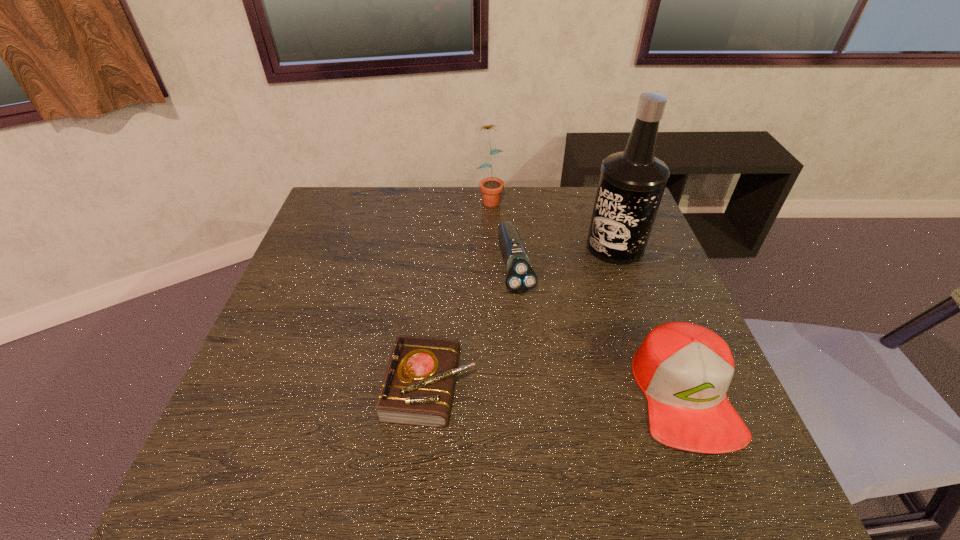
Locate an element on the screen. The width and height of the screenshot is (960, 540). diary is located at coordinates (417, 389).

This screenshot has width=960, height=540. In order to click on baseball cap in this screenshot , I will do `click(684, 370)`.

Find the location of a particular element. The width and height of the screenshot is (960, 540). liquor is located at coordinates (631, 185).

The image size is (960, 540). I want to click on the fourth shortest object, so click(x=491, y=187).

Find the location of `the farthest object`. the farthest object is located at coordinates (491, 187).

At what (x,y) coordinates should I click in order to perform the action: click on electric shaver. Please return your answer as a coordinate pair (x, y). Looking at the image, I should click on (520, 277).

Identify the location of vacant space situated on the left of the shortest object. (308, 386).

In order to click on vacant space positioned on the front label of the tallest object in this screenshot , I will do `click(576, 318)`.

I want to click on free space located 0.290m on the front label of the tallest object, so click(566, 335).

You are a GUI agent. You are given a task and a screenshot of the screen. Output one action in this format:
    pyautogui.click(x=<x>, y=<y>)
    Task: Click on the vacant space situated 0.210m on the front label of the tallest object
    This screenshot has width=960, height=540.
    Given the screenshot: What is the action you would take?
    pyautogui.click(x=579, y=313)